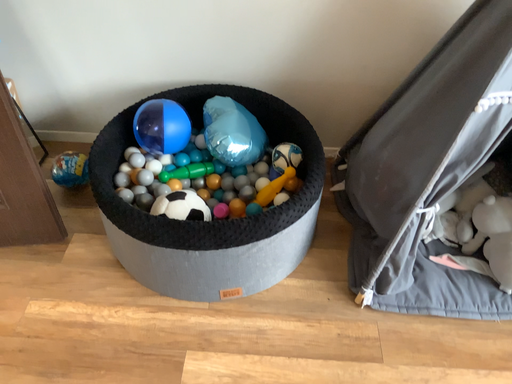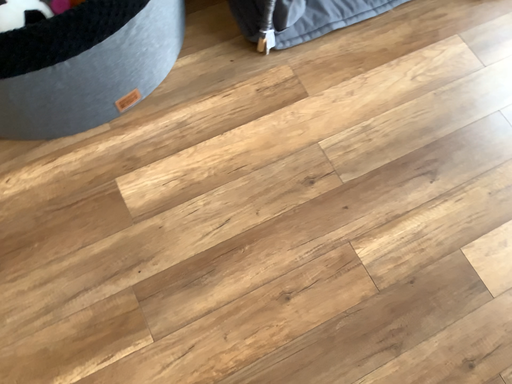
Question: Which way did the camera rotate in the video?

Choices:
 (A) rotated upward
 (B) rotated downward

Answer: (B)